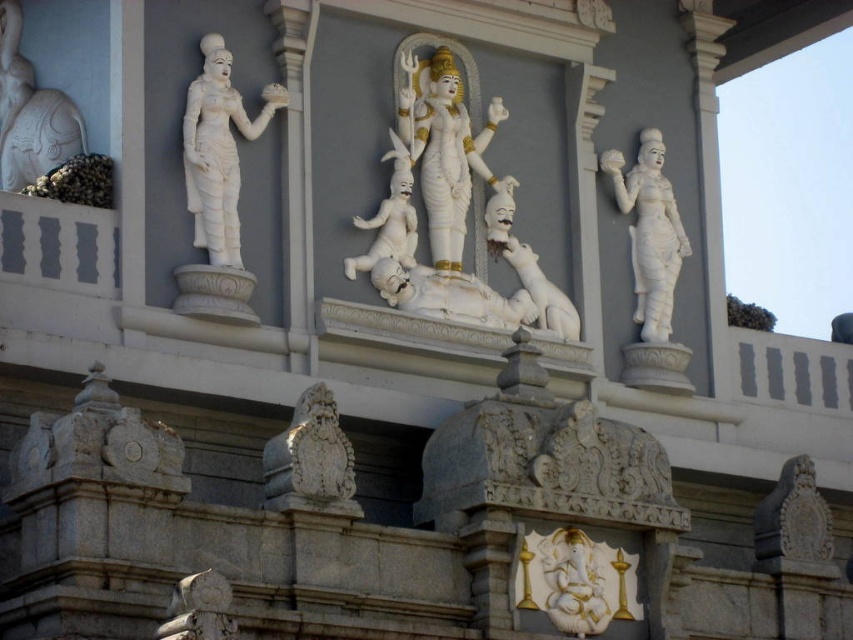
Question: Observing the image, what is the correct spatial positioning of white marble statue at left in reference to carved stone lion at center?

Choices:
 (A) left
 (B) right

Answer: (A)

Question: Which object is closer to the camera taking this photo?

Choices:
 (A) white stone elephant at upper left
 (B) white marble rabbit at center

Answer: (B)

Question: Which of the following is the closest to the observer?

Choices:
 (A) (25, 67)
 (B) (215, 134)

Answer: (B)

Question: Based on their relative distances, which object is farther from the white marble statue at right?

Choices:
 (A) white marble statue at left
 (B) white marble rabbit at center
 (C) white stone elephant at upper left

Answer: (C)

Question: Can you confirm if white stone elephant at upper left is positioned above white marble rabbit at center?

Choices:
 (A) no
 (B) yes

Answer: (B)

Question: Can you confirm if white marble statue at left is bigger than white marble rabbit at center?

Choices:
 (A) yes
 (B) no

Answer: (B)